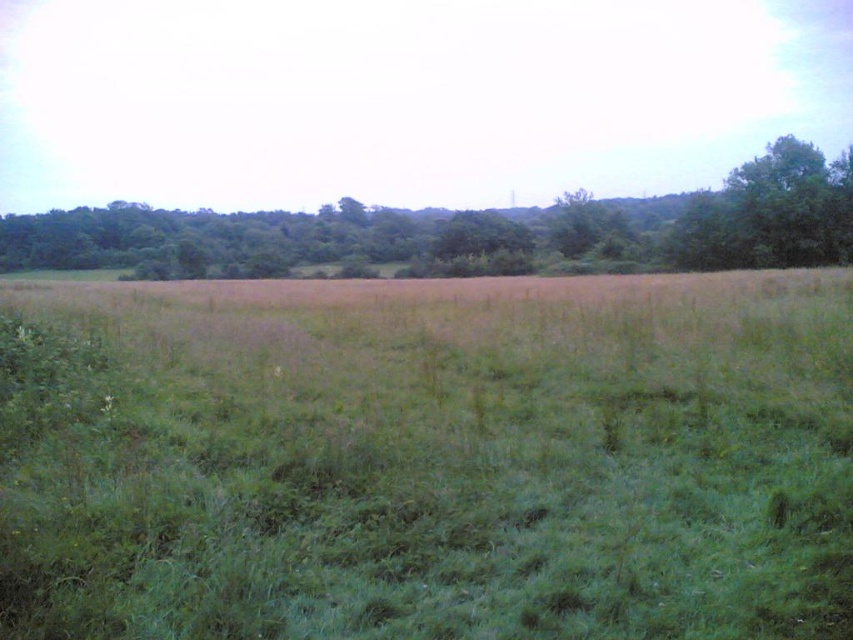
At what (x,y) coordinates should I click in order to perform the action: click on green leafy tree at upper center. Please return your answer as a coordinate pair (x, y). The image size is (853, 640). Looking at the image, I should click on (469, 230).

The height and width of the screenshot is (640, 853). What do you see at coordinates (469, 230) in the screenshot?
I see `green leafy tree at upper center` at bounding box center [469, 230].

Locate an element on the screen. This screenshot has height=640, width=853. green leafy tree at upper center is located at coordinates (469, 230).

In order to click on green leafy tree at upper center in this screenshot , I will do `click(469, 230)`.

Describe the element at coordinates (427, 458) in the screenshot. This screenshot has height=640, width=853. I see `green grassy field at center` at that location.

Is point (572, 451) farther from viewer compared to point (341, 273)?

That is False.

What do you see at coordinates (427, 458) in the screenshot? This screenshot has height=640, width=853. I see `green grassy field at center` at bounding box center [427, 458].

The height and width of the screenshot is (640, 853). Find the location of `green grassy field at center`. green grassy field at center is located at coordinates (427, 458).

Between green grassy field at center and green leafy tree at upper right, which one has less height?

green grassy field at center

Does point (682, 278) come farther from viewer compared to point (737, 170)?

No, (682, 278) is closer to viewer.

Where is `green grassy field at center`? This screenshot has height=640, width=853. green grassy field at center is located at coordinates (427, 458).